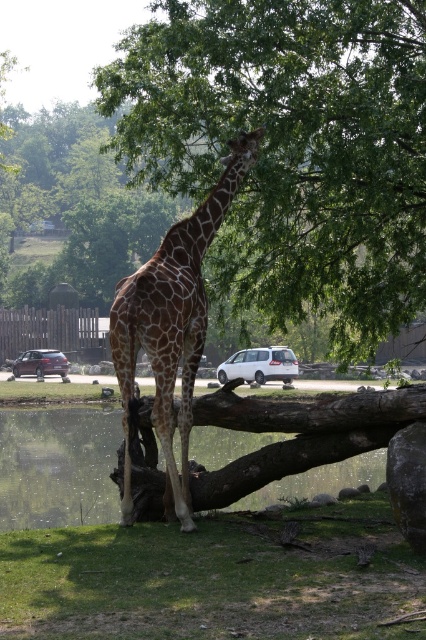
Does spotted fur giraffe at center appear on the right side of white matte van at center?

In fact, spotted fur giraffe at center is to the left of white matte van at center.

Does point (189, 422) come closer to viewer compared to point (222, 371)?

That is True.

Where is `spotted fur giraffe at center`? This screenshot has width=426, height=640. spotted fur giraffe at center is located at coordinates (172, 328).

Image resolution: width=426 pixels, height=640 pixels. Find the location of `green grass at lower center`. green grass at lower center is located at coordinates (218, 579).

Does point (267, 563) come closer to viewer compared to point (322, 444)?

Yes, it is in front of point (322, 444).

The width and height of the screenshot is (426, 640). I want to click on green grass at lower center, so click(x=218, y=579).

Identify the location of brown rough tree trunk at center. The height and width of the screenshot is (640, 426). (298, 433).

Identify the location of brown rough tree trunk at center. The image size is (426, 640). (298, 433).

Find the location of a particular element. This screenshot has width=426, height=640. brown rough tree trunk at center is located at coordinates tap(298, 433).